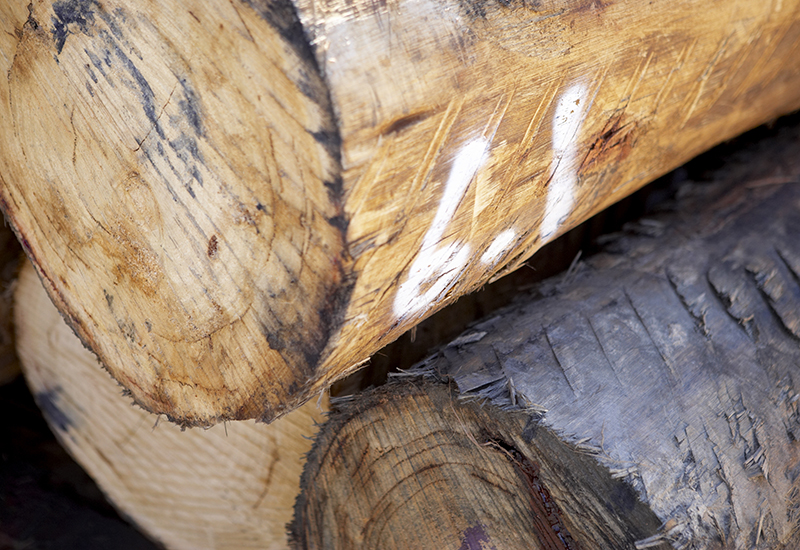
Where is `dark brown gouge in wood`? The height and width of the screenshot is (550, 800). dark brown gouge in wood is located at coordinates click(554, 518).